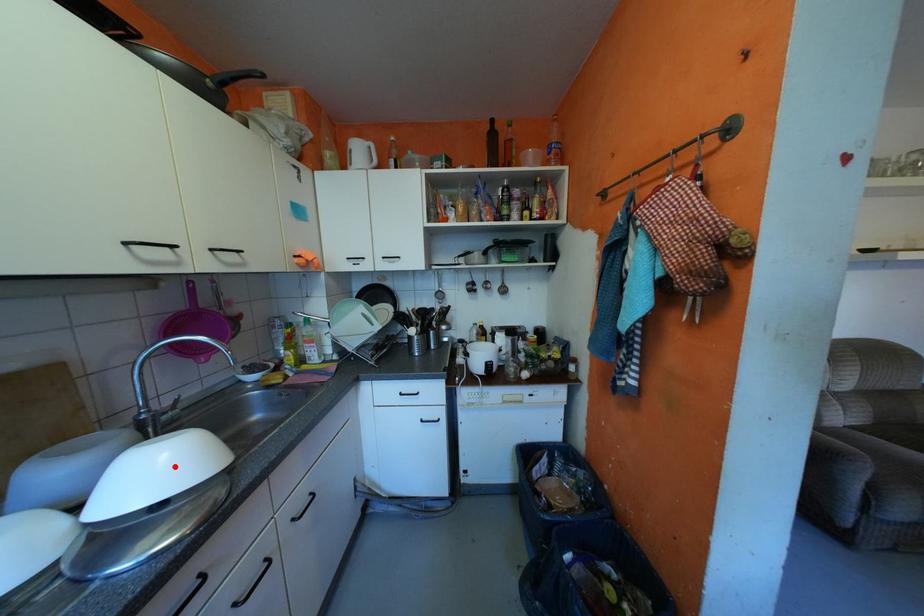
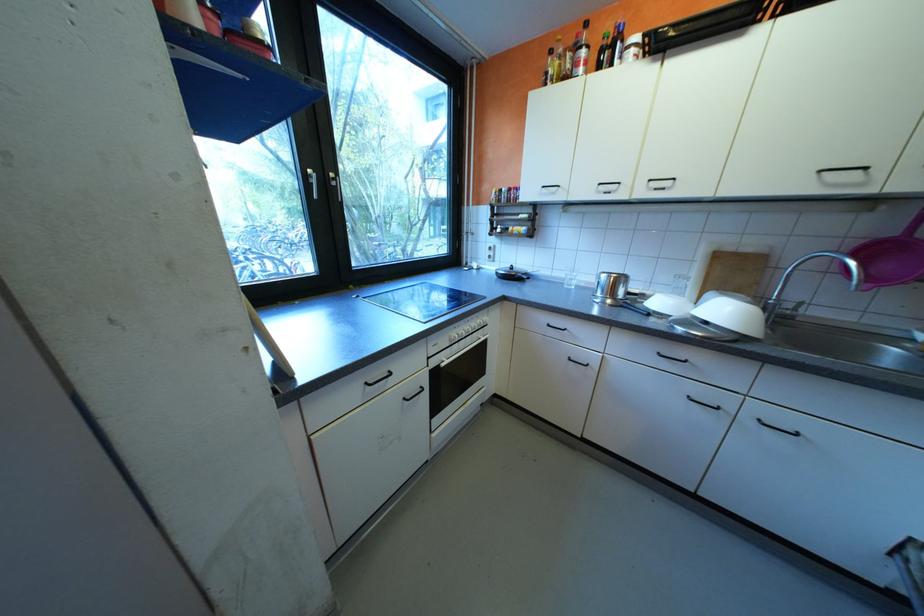
The point at the highlighted location is marked in the first image. Where is the corresponding point in the second image?

(736, 312)